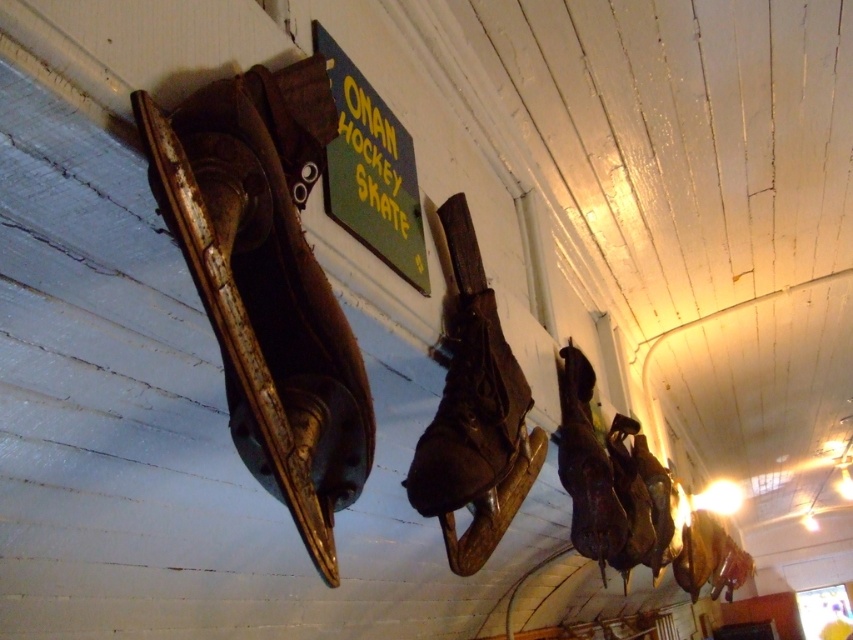
You are standing in front of the vintage hockey skates displayed on the wall. There are two points marked on the wall at coordinates point [251,424] and point [445,401]. Which point is closer to you?

Point [251,424] is in front of point [445,401], so it is closer to you.

You are an interior designer planning to place a rectangular decorative plaque next to the leather at left and the brown leather skate at center. The plaque is 12 inches wide. Which object should the plaque be placed next to so that it doesn

The plaque should be placed next to the brown leather skate at center because the leather at left is narrower than the brown leather skate at center, so the plaque will fit better next to the wider object.